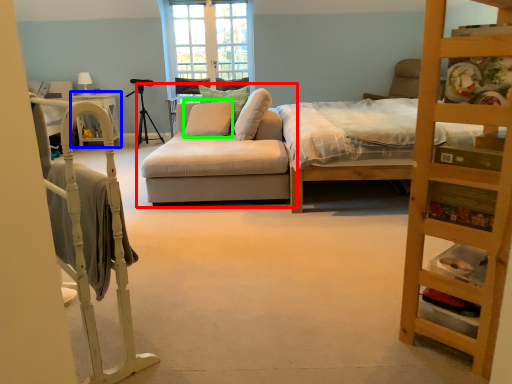
Question: Which object is the farthest from studio couch (highlighted by a red box)? Choose among these: table (highlighted by a blue box) or pillow (highlighted by a green box).

Choices:
 (A) table
 (B) pillow

Answer: (A)